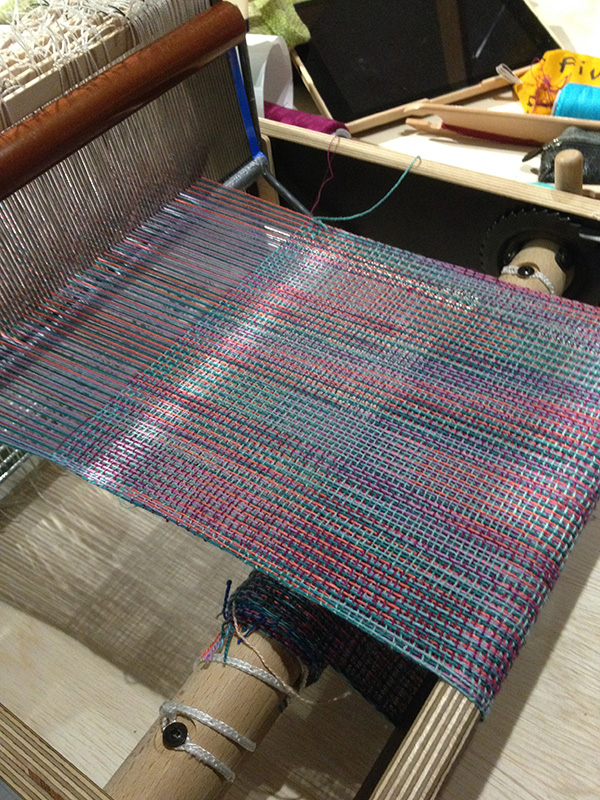
Where is `yellow fabric`? This screenshot has height=800, width=600. yellow fabric is located at coordinates (575, 69).